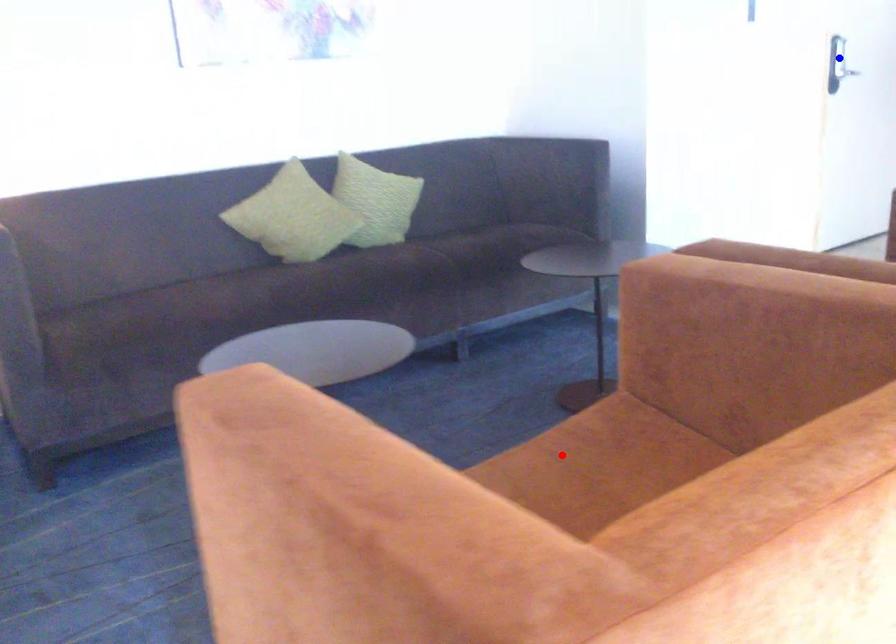
Question: Which of the two points in the image is closer to the camera?

Choices:
 (A) Blue point is closer.
 (B) Red point is closer.

Answer: (B)